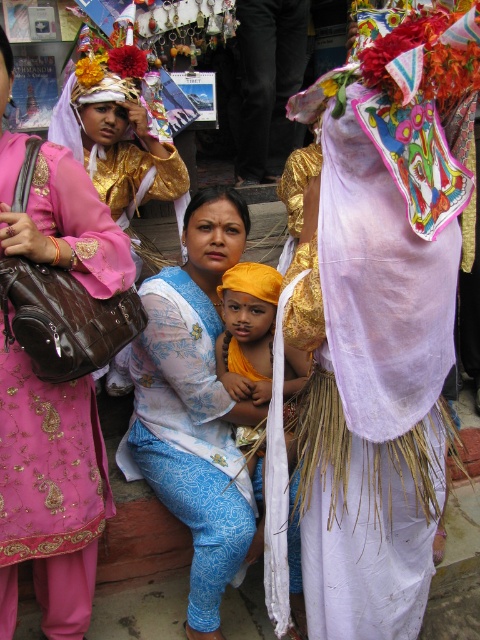
At what (x,y) coordinates should I click in order to perform the action: click on matte pink dress at left. Please return your answer as a coordinate pair (x, y). The width and height of the screenshot is (480, 640). Looking at the image, I should click on (49, 493).

At what (x,y) coordinates should I click in order to perform the action: click on matte pink dress at left. Please return your answer as a coordinate pair (x, y). Image resolution: width=480 pixels, height=640 pixels. Looking at the image, I should click on (49, 493).

You are a GUI agent. You are given a task and a screenshot of the screen. Output one action in this format:
    pyautogui.click(x=<x>, y=<y>)
    Task: Click on the matte pink dress at left
    This screenshot has width=480, height=640.
    Given the screenshot: What is the action you would take?
    pyautogui.click(x=49, y=493)

Between white sheer cloth at center and blue printed fabric at center, which one has more height?

white sheer cloth at center is taller.

Describe the element at coordinates (372, 333) in the screenshot. I see `white sheer cloth at center` at that location.

What do you see at coordinates (372, 333) in the screenshot? I see `white sheer cloth at center` at bounding box center [372, 333].

I want to click on white sheer cloth at center, so click(x=372, y=333).

Is the position of white sheer cloth at center more distant than that of matte pink dress at left?

No.

Does white sheer cloth at center have a greater height compared to matte pink dress at left?

Yes, white sheer cloth at center is taller than matte pink dress at left.

The image size is (480, 640). What do you see at coordinates (372, 333) in the screenshot?
I see `white sheer cloth at center` at bounding box center [372, 333].

The image size is (480, 640). What are the coordinates of `white sheer cloth at center` in the screenshot? It's located at (372, 333).